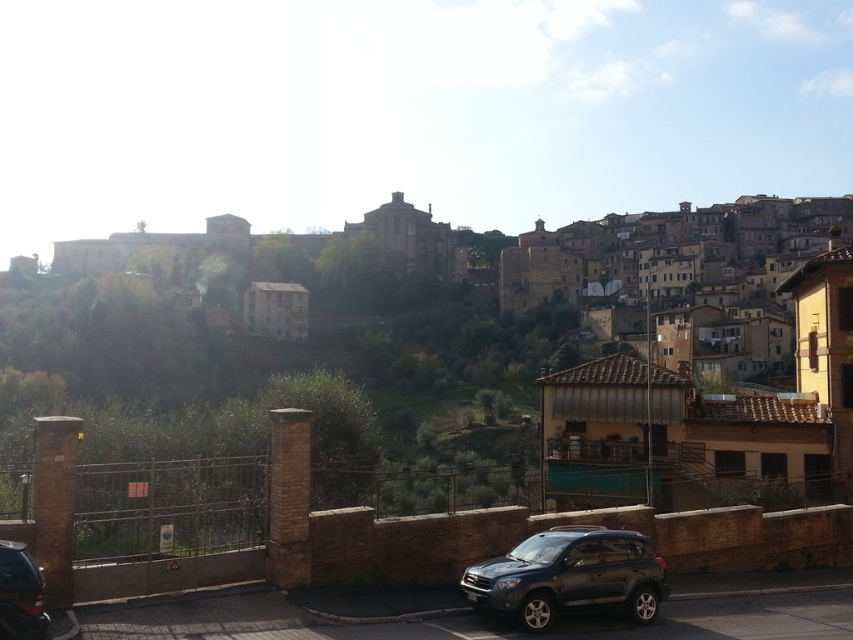
Question: Observing the image, what is the correct spatial positioning of satin dark gray suv at lower center in reference to shiny black car at lower left?

Choices:
 (A) right
 (B) left

Answer: (A)

Question: Is satin dark gray suv at lower center below shiny black car at lower left?

Choices:
 (A) no
 (B) yes

Answer: (B)

Question: Is satin dark gray suv at lower center wider than shiny black car at lower left?

Choices:
 (A) yes
 (B) no

Answer: (A)